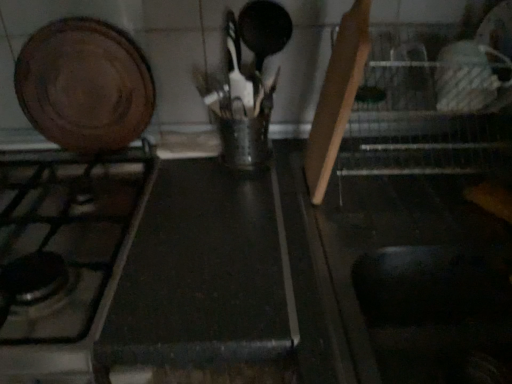
What do you see at coordinates (203, 273) in the screenshot? The image size is (512, 384). I see `black matte counter top at center` at bounding box center [203, 273].

Find the location of `wooden cutting board at upper left`. wooden cutting board at upper left is located at coordinates (84, 85).

Considering the relative positions of matte black gas stove at left and wooden cutting board at upper left in the image provided, is matte black gas stove at left to the left of wooden cutting board at upper left from the viewer's perspective?

Yes.

Considering the sizes of objects matte black gas stove at left and wooden cutting board at upper left in the image provided, who is wider, matte black gas stove at left or wooden cutting board at upper left?

Wider between the two is matte black gas stove at left.

Locate an element on the screen. kitchen appliance lying behind the matte black gas stove at left is located at coordinates (84, 85).

Measure the distance between matte black gas stove at left and wooden cutting board at upper left.

They are 21.60 centimeters apart.

Is wooden cutting board at upper left situated inside black matte counter top at center or outside?

wooden cutting board at upper left is outside black matte counter top at center.

From a real-world perspective, who is located lower, wooden cutting board at upper left or black matte counter top at center?

In real-world perspective, black matte counter top at center is lower.

From the image's perspective, does wooden cutting board at upper left appear higher than black matte counter top at center?

Yes, from the image's perspective, wooden cutting board at upper left is above black matte counter top at center.

Who is smaller, wooden cutting board at upper left or black matte counter top at center?

wooden cutting board at upper left is smaller.

From the image's perspective, which object appears higher, black matte counter top at center or wooden cutting board at upper left?

wooden cutting board at upper left is shown above in the image.

Which is more to the right, black matte counter top at center or wooden cutting board at upper left?

black matte counter top at center is more to the right.

Can you confirm if black matte counter top at center is taller than wooden cutting board at upper left?

Yes.

Is black matte counter top at center far away from wooden cutting board at upper left?

No, black matte counter top at center is not far from wooden cutting board at upper left.

Does matte black gas stove at left touch black matte counter top at center?

No, matte black gas stove at left is not next to black matte counter top at center.

Does matte black gas stove at left appear on the left side of black matte counter top at center?

Yes, matte black gas stove at left is to the left of black matte counter top at center.

From the image's perspective, relative to black matte counter top at center, is matte black gas stove at left above or below?

Based on their image positions, matte black gas stove at left is located above black matte counter top at center.

Does black matte counter top at center come in front of matte black gas stove at left?

No, it is not.

From a real-world perspective, is black matte counter top at center located higher than matte black gas stove at left?

Actually, black matte counter top at center is physically below matte black gas stove at left in the real world.

Is black matte counter top at center not within matte black gas stove at left?

black matte counter top at center is positioned outside matte black gas stove at left.

This screenshot has width=512, height=384. What are the coordinates of `gas stove above the black matte counter top at center (from a real-world perspective)` in the screenshot? It's located at [63, 255].

Is wooden cutting board at upper left thinner than matte black gas stove at left?

Yes, wooden cutting board at upper left is thinner than matte black gas stove at left.

Where is `kitchen appliance behind the matte black gas stove at left`? The width and height of the screenshot is (512, 384). kitchen appliance behind the matte black gas stove at left is located at coordinates [84, 85].

From the image's perspective, does wooden cutting board at upper left appear lower than matte black gas stove at left?

No, from the image's perspective, wooden cutting board at upper left is not below matte black gas stove at left.

Which point is more forward, (x=147, y=121) or (x=59, y=258)?

The point (x=59, y=258) is closer to the camera.

The width and height of the screenshot is (512, 384). In the image, there is a wooden cutting board at upper left. In order to click on gas stove below it (from the image's perspective) in this screenshot , I will do `click(63, 255)`.

Locate an element on the screen. This screenshot has width=512, height=384. kitchen appliance located above the black matte counter top at center (from a real-world perspective) is located at coordinates (84, 85).

Which object lies nearer to the anchor point wooden cutting board at upper left, matte black gas stove at left or black matte counter top at center?

Based on the image, matte black gas stove at left appears to be nearer to wooden cutting board at upper left.

Considering their positions, is wooden cutting board at upper left positioned closer to matte black gas stove at left than black matte counter top at center?

black matte counter top at center is positioned closer to the anchor matte black gas stove at left.

Considering their positions, is wooden cutting board at upper left positioned closer to black matte counter top at center than matte black gas stove at left?

Among the two, matte black gas stove at left is located nearer to black matte counter top at center.

From the image, which object appears to be farther from wooden cutting board at upper left, black matte counter top at center or matte black gas stove at left?

black matte counter top at center is further to wooden cutting board at upper left.

Looking at the image, which one is located closer to black matte counter top at center, matte black gas stove at left or wooden cutting board at upper left?

matte black gas stove at left.

Based on their spatial positions, is black matte counter top at center or wooden cutting board at upper left closer to matte black gas stove at left?

black matte counter top at center.

The height and width of the screenshot is (384, 512). In order to click on gas stove between wooden cutting board at upper left and black matte counter top at center from top to bottom in this screenshot , I will do `click(63, 255)`.